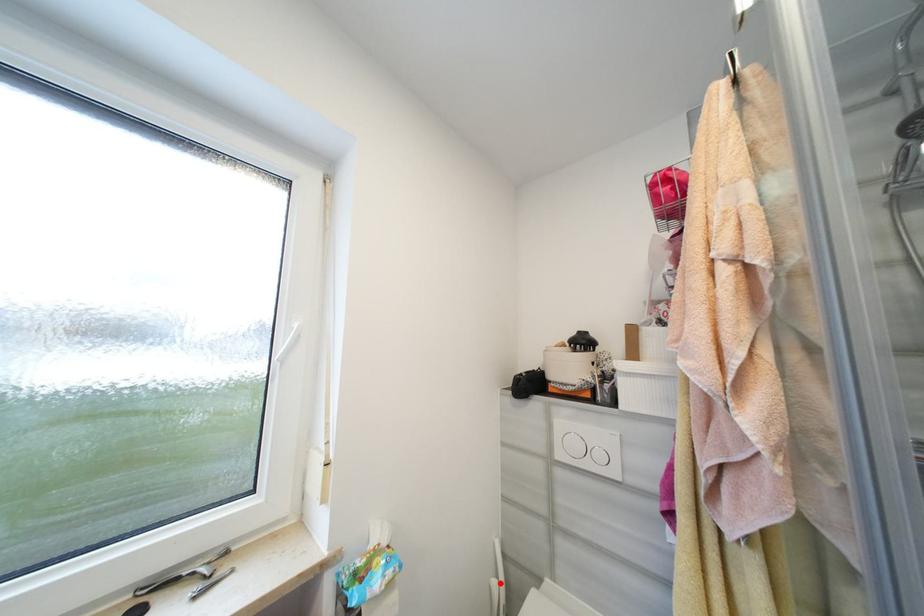
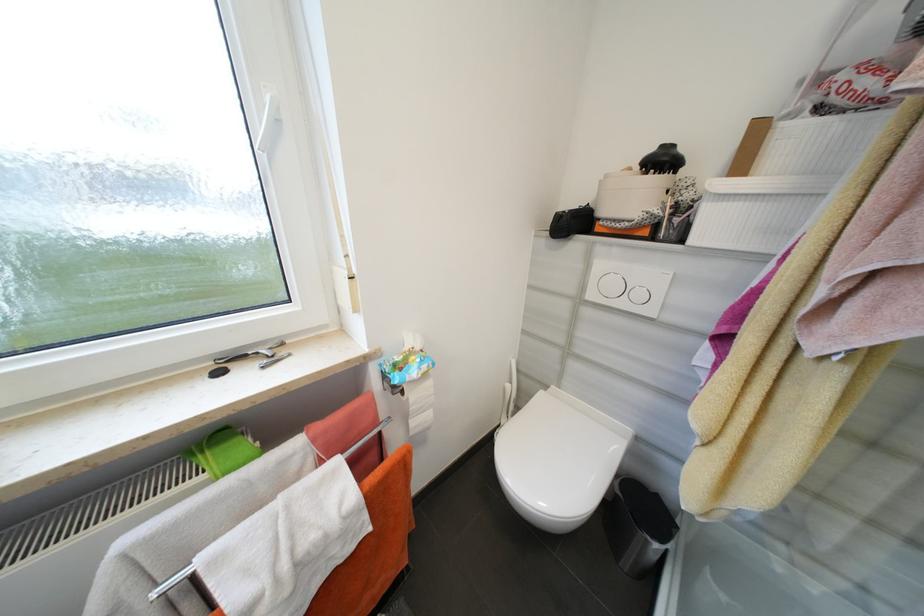
Question: I am providing you with two images of the same scene from different viewpoints. A red point is marked on the first image. At the location where the point appears in image 1, is it still visible in image 2?

Choices:
 (A) Yes
 (B) No

Answer: (A)